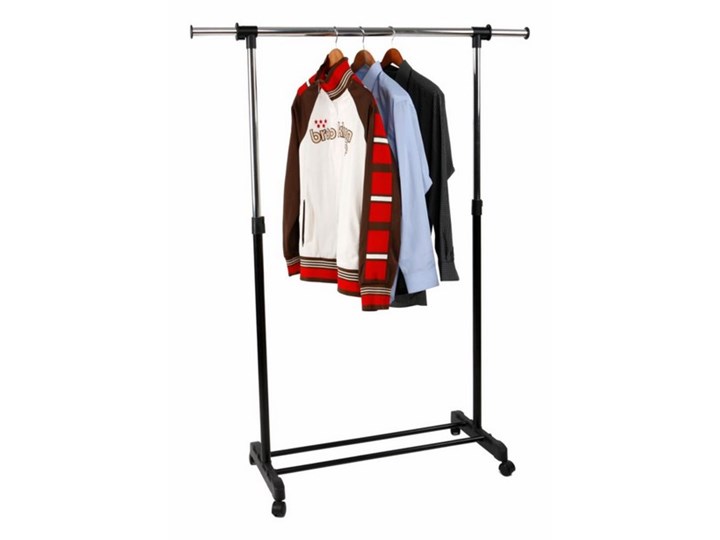
Identify the location of clothes rack. (220, 31), (508, 32), (477, 100), (253, 123), (276, 487), (252, 460), (337, 464), (351, 438), (454, 423), (508, 472).